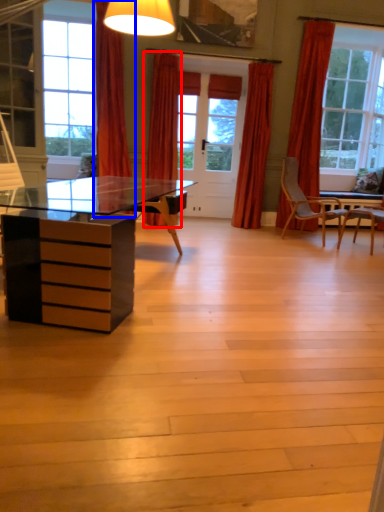
Question: Which of the following is the closest to the observer, curtain (highlighted by a red box) or curtain (highlighted by a blue box)?

Choices:
 (A) curtain
 (B) curtain

Answer: (B)